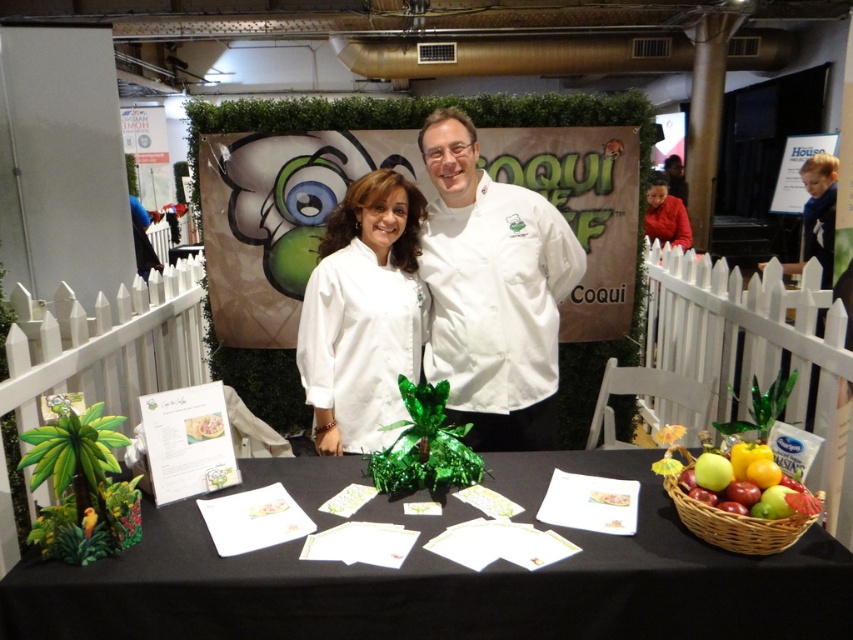
You are a photographer setting up for an event. You need to position a camera so that both the white glossy chef coat at center and the green matte apple at center are in the frame. Based on their sizes, which object will appear larger in the photo?

The white glossy chef coat at center will appear larger in the photo because it is wider than the green matte apple at center according to the description.

You are a food critic who needs to move from the black fabric table at center to the white matte chef coat at center to interview the chef. Can you comfortably walk through the space between them?

The distance between the black fabric table at center and the white matte chef coat at center is 23.12 inches. Since this space is narrow, it might be challenging to comfortably walk through, especially if carrying items. Consider moving around the sides instead.